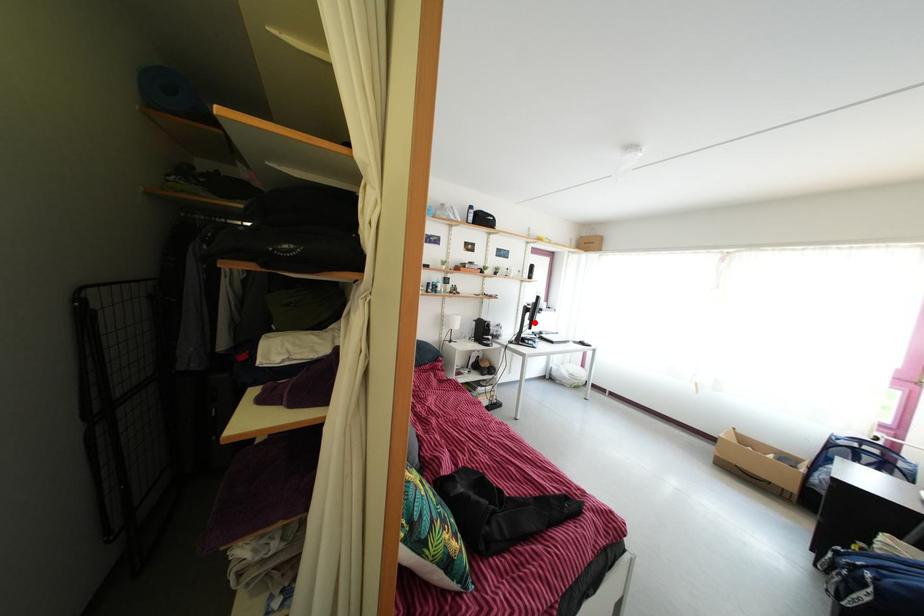
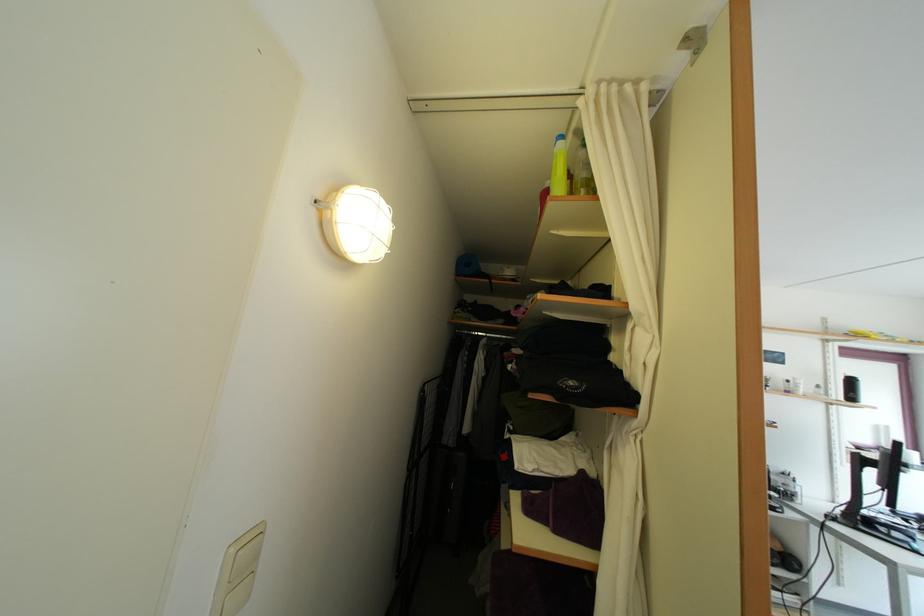
Where in the second image is the point corresponding to the highlighted location from the first image?

(878, 480)